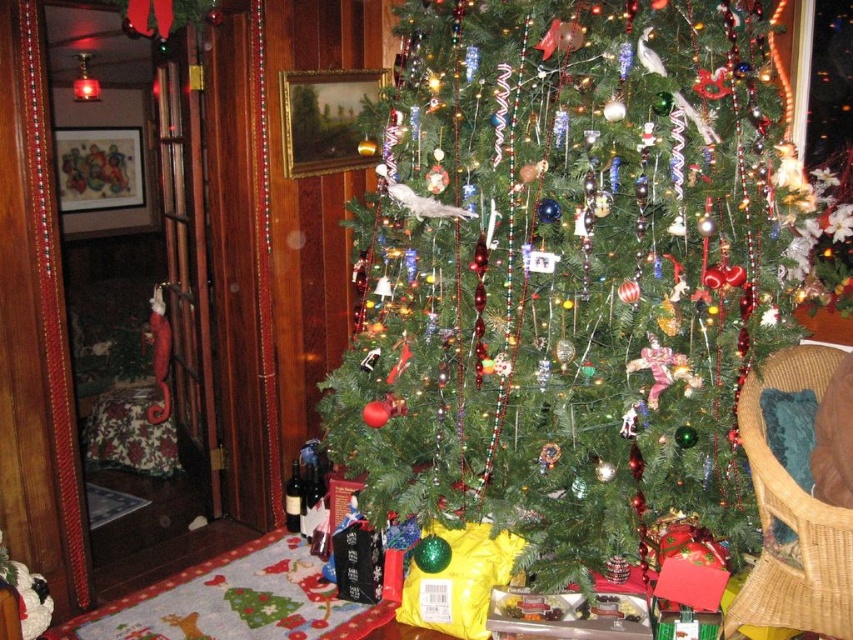
Question: Which of the following is the closest to the observer?

Choices:
 (A) tap(299, 492)
 (B) tap(315, 465)
 (C) tap(639, 243)

Answer: (C)

Question: Does green matte christmas tree at center have a lesser width compared to woven wicker chair at lower right?

Choices:
 (A) yes
 (B) no

Answer: (B)

Question: Is green matte christmas tree at center above woven wicker chair at lower right?

Choices:
 (A) no
 (B) yes

Answer: (B)

Question: Where is green matte christmas tree at center located in relation to woven wicker chair at lower right in the image?

Choices:
 (A) above
 (B) below

Answer: (A)

Question: Which of these objects is positioned closest to the matte glass wine bottle at lower left?

Choices:
 (A) green matte christmas tree at center
 (B) woven wicker chair at lower right

Answer: (A)

Question: Among these objects, which one is nearest to the camera?

Choices:
 (A) green matte christmas tree at center
 (B) woven wicker chair at lower right

Answer: (B)